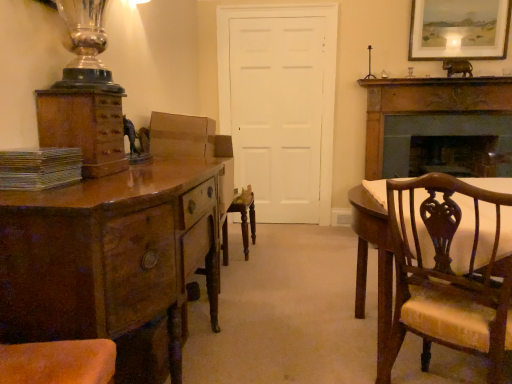
Question: Should I look upward or downward to see dark brown wood fireplace at right?

Choices:
 (A) up
 (B) down

Answer: (A)

Question: Considering the relative positions of brown wood cabinet at left and matte white picture frame at upper right in the image provided, is brown wood cabinet at left to the left of matte white picture frame at upper right from the viewer's perspective?

Choices:
 (A) yes
 (B) no

Answer: (A)

Question: From a real-world perspective, is brown wood cabinet at left located higher than matte white picture frame at upper right?

Choices:
 (A) yes
 (B) no

Answer: (B)

Question: Is brown wood cabinet at left in contact with matte white picture frame at upper right?

Choices:
 (A) no
 (B) yes

Answer: (A)

Question: Is brown wood cabinet at left positioned in front of matte white picture frame at upper right?

Choices:
 (A) no
 (B) yes

Answer: (B)

Question: Can you confirm if brown wood cabinet at left is bigger than matte white picture frame at upper right?

Choices:
 (A) no
 (B) yes

Answer: (A)

Question: Are brown wood cabinet at left and matte white picture frame at upper right located far from each other?

Choices:
 (A) yes
 (B) no

Answer: (A)

Question: Can you confirm if white matte door at center is taller than matte white picture frame at upper right?

Choices:
 (A) yes
 (B) no

Answer: (A)

Question: Are white matte door at center and matte white picture frame at upper right located far from each other?

Choices:
 (A) yes
 (B) no

Answer: (A)

Question: Considering the relative sizes of white matte door at center and matte white picture frame at upper right in the image provided, is white matte door at center shorter than matte white picture frame at upper right?

Choices:
 (A) no
 (B) yes

Answer: (A)

Question: Can you confirm if white matte door at center is smaller than matte white picture frame at upper right?

Choices:
 (A) no
 (B) yes

Answer: (A)

Question: Is white matte door at center oriented away from matte white picture frame at upper right?

Choices:
 (A) no
 (B) yes

Answer: (A)

Question: From the image's perspective, is white matte door at center under matte white picture frame at upper right?

Choices:
 (A) no
 (B) yes

Answer: (B)

Question: Would you say metallic silver book at left is part of shiny brown wood chest of drawers at left's contents?

Choices:
 (A) yes
 (B) no

Answer: (B)